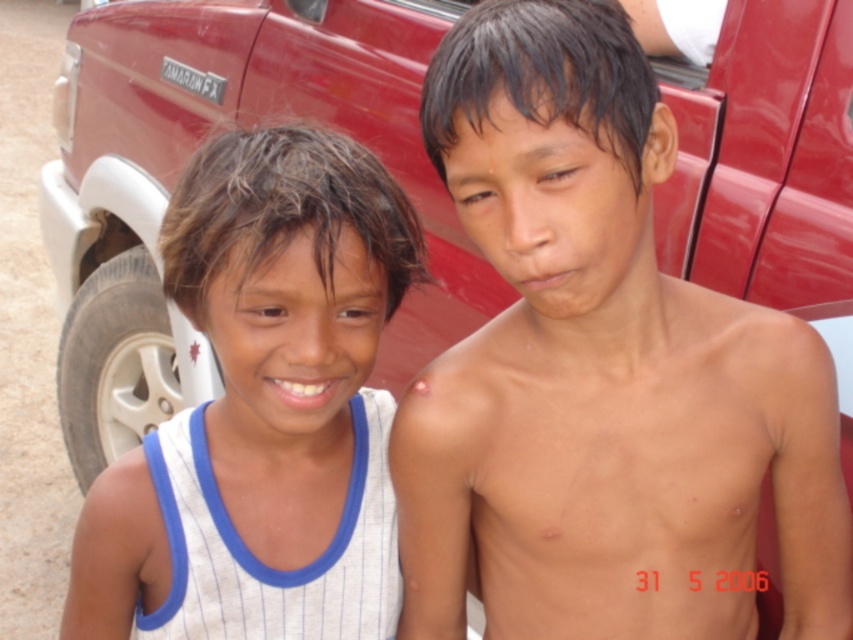
Does matte red truck at upper center have a greater height compared to white striped tank top at left?

Yes.

Is point (793, 150) closer to viewer compared to point (360, 584)?

That is True.

You are a GUI agent. You are given a task and a screenshot of the screen. Output one action in this format:
    pyautogui.click(x=<x>, y=<y>)
    Task: Click on the matte red truck at upper center
    This screenshot has width=853, height=640.
    Given the screenshot: What is the action you would take?
    pyautogui.click(x=190, y=152)

Where is `matte red truck at upper center`? This screenshot has width=853, height=640. matte red truck at upper center is located at coordinates (190, 152).

Between point (740, 410) and point (155, 627), which one is positioned behind?

Point (155, 627)

The width and height of the screenshot is (853, 640). Find the location of `smooth skin boy at center`. smooth skin boy at center is located at coordinates (601, 372).

Describe the element at coordinates (601, 372) in the screenshot. I see `smooth skin boy at center` at that location.

Can you confirm if smooth skin boy at center is wider than matte red truck at upper center?

No.

Is point (457, 620) farther from camera compared to point (62, 396)?

No, it is not.

Where is `smooth skin boy at center`? The image size is (853, 640). smooth skin boy at center is located at coordinates (601, 372).